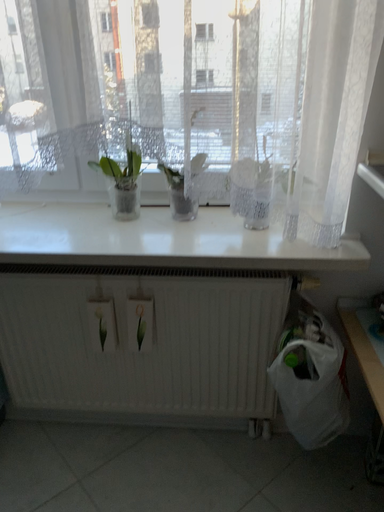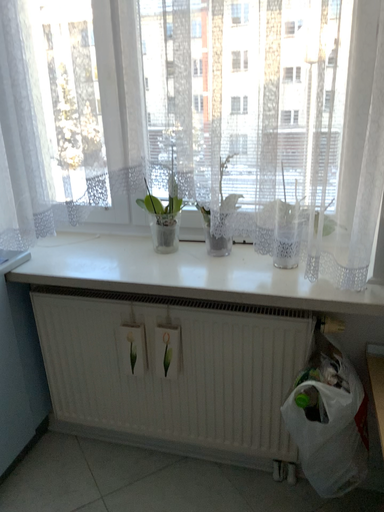
Question: Which way did the camera rotate in the video?

Choices:
 (A) rotated right
 (B) rotated left

Answer: (B)